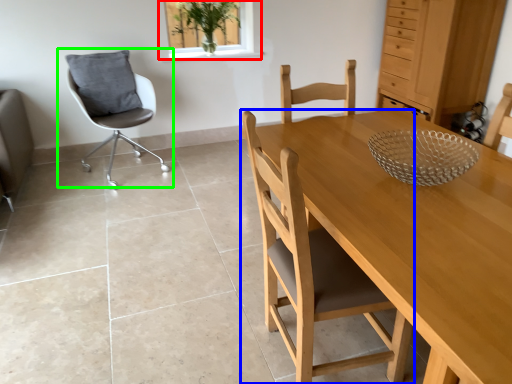
Question: Which object is positioned closest to window (highlighted by a red box)? Select from chair (highlighted by a blue box) and chair (highlighted by a green box).

Choices:
 (A) chair
 (B) chair

Answer: (B)